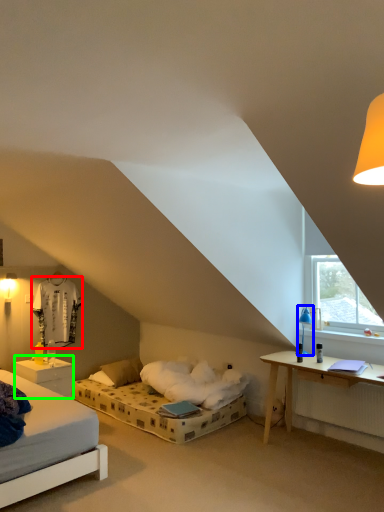
Question: Estimate the real-world distances between objects in this image. Which object is farther from sheet (highlighted by a red box), table lamp (highlighted by a blue box) or nightstand (highlighted by a green box)?

Choices:
 (A) table lamp
 (B) nightstand

Answer: (A)